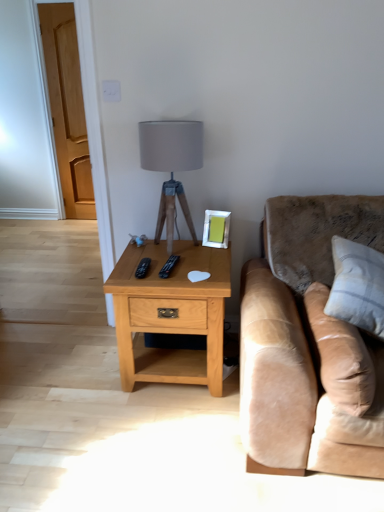
The image size is (384, 512). Identify the location of vacant area that is in front of black plastic remote at center. (174, 280).